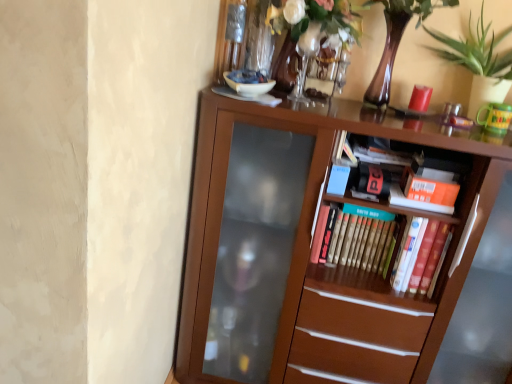
Question: Is brown wooden bookcase at center inside or outside of orange matte paperback book at upper right, arranged as the first paperback book when viewed from the right?

Choices:
 (A) inside
 (B) outside

Answer: (B)

Question: From the image's perspective, is brown wooden bookcase at center located above or below orange matte paperback book at upper right, which is counted as the third paperback book, starting from the left?

Choices:
 (A) above
 (B) below

Answer: (B)

Question: Considering the real-world distances, which object is farthest from the translucent glass vase at upper center?

Choices:
 (A) orange matte paperback book at upper right, which is counted as the third paperback book, starting from the left
 (B) hardcover book at center, positioned as the second paperback book in left-to-right order
 (C) green leafy plant at upper right
 (D) hardcover book at center, which appears as the 3th paperback book when viewed from the right
 (E) brown wooden bookcase at center

Answer: (B)

Question: Considering the real-world distances, which object is closest to the hardcover book at center, positioned as the second paperback book in left-to-right order?

Choices:
 (A) translucent glass vase at upper center
 (B) brown wooden bookcase at center
 (C) green leafy plant at upper right
 (D) orange matte paperback book at upper right, which is counted as the third paperback book, starting from the left
 (E) hardcover book at center, which appears as the 3th paperback book when viewed from the right

Answer: (D)